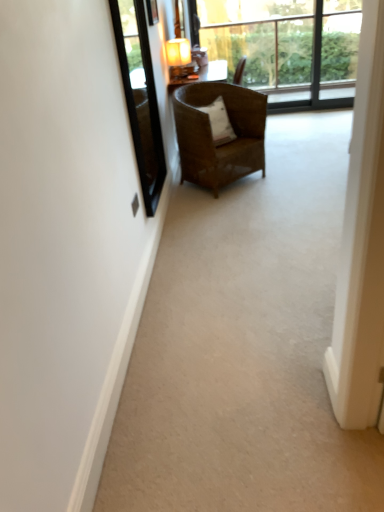
Question: Can you confirm if transparent glass window at upper center is wider than transparent glass window screen at upper left?

Choices:
 (A) no
 (B) yes

Answer: (B)

Question: Does transparent glass window at upper center come behind transparent glass window screen at upper left?

Choices:
 (A) yes
 (B) no

Answer: (A)

Question: Is transparent glass window at upper center far from transparent glass window screen at upper left?

Choices:
 (A) no
 (B) yes

Answer: (B)

Question: From the image's perspective, would you say transparent glass window at upper center is shown under transparent glass window screen at upper left?

Choices:
 (A) yes
 (B) no

Answer: (B)

Question: Is transparent glass window at upper center closer to the viewer compared to transparent glass window screen at upper left?

Choices:
 (A) yes
 (B) no

Answer: (B)

Question: Does point (147, 90) appear closer or farther from the camera than point (215, 98)?

Choices:
 (A) farther
 (B) closer

Answer: (A)

Question: Considering the positions of transparent glass window screen at upper left and white soft pillow at center in the image, is transparent glass window screen at upper left wider or thinner than white soft pillow at center?

Choices:
 (A) wide
 (B) thin

Answer: (B)

Question: In the image, is transparent glass window screen at upper left on the left side or the right side of white soft pillow at center?

Choices:
 (A) right
 (B) left

Answer: (B)

Question: From a real-world perspective, is transparent glass window screen at upper left physically located above or below white soft pillow at center?

Choices:
 (A) below
 (B) above

Answer: (B)

Question: Is transparent glass window screen at upper left to the left or to the right of brown woven chair at center in the image?

Choices:
 (A) left
 (B) right

Answer: (A)

Question: From the image's perspective, is transparent glass window screen at upper left above or below brown woven chair at center?

Choices:
 (A) above
 (B) below

Answer: (B)

Question: Is point (119, 38) positioned closer to the camera than point (258, 113)?

Choices:
 (A) closer
 (B) farther

Answer: (A)

Question: From a real-world perspective, is transparent glass window screen at upper left positioned above or below brown woven chair at center?

Choices:
 (A) below
 (B) above

Answer: (B)

Question: From a real-world perspective, relative to transparent glass window at upper center, is white soft pillow at center vertically above or below?

Choices:
 (A) above
 (B) below

Answer: (B)

Question: In the image, is white soft pillow at center on the left side or the right side of transparent glass window at upper center?

Choices:
 (A) right
 (B) left

Answer: (B)